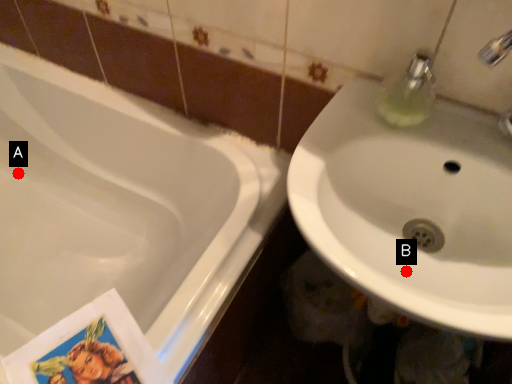
Question: Two points are circled on the image, labeled by A and B beside each circle. Which point is farther from the camera taking this photo?

Choices:
 (A) A is further
 (B) B is further

Answer: (A)